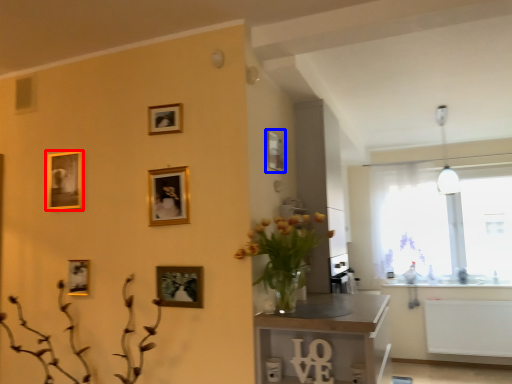
Question: Which of the following is the farthest to the observer, picture frame (highlighted by a red box) or decorative picture (highlighted by a blue box)?

Choices:
 (A) picture frame
 (B) decorative picture

Answer: (A)